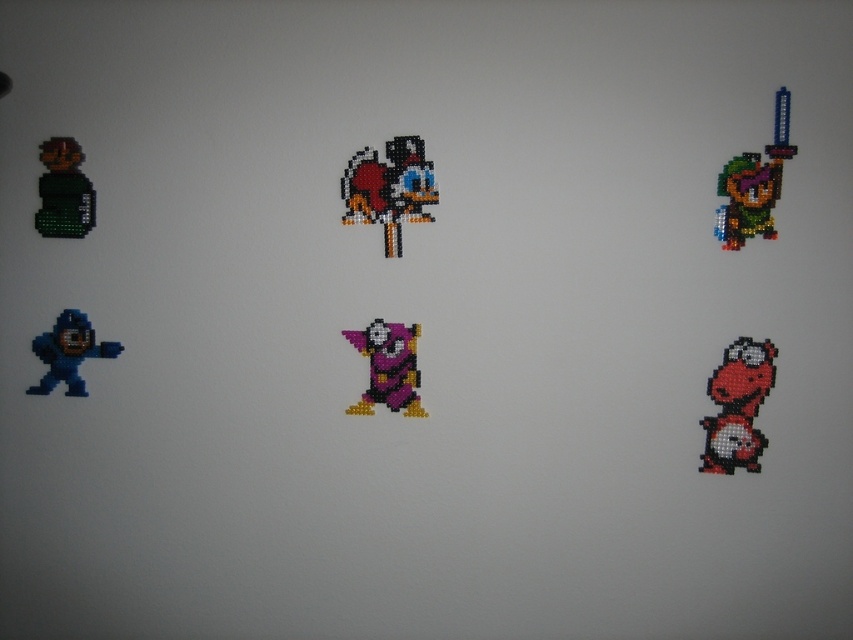
You are standing at the multicolored beaded figure at upper right and want to reach the closest object. Which object is it?

The closest object to the multicolored beaded figure at upper right is the green figure with a red helmet at top left, as they are 3.94 feet apart.

Consider the image. You are standing in front of the image and want to touch both the pixelated yellow duck at center and the blue matte astronaut at lower left. Which one can you reach first without moving your hand?

The pixelated yellow duck at center is in front of the blue matte astronaut at lower left, so you can reach the pixelated yellow duck at center first without moving your hand.

You are standing at the bottom left corner of the image. You need to walk to the point marked as point (x=77, y=214). However, there is an obstacle at point (x=732, y=179). Will you encounter the obstacle before reaching your destination?

Yes, you will encounter the obstacle at point (x=732, y=179) before reaching the destination at point (x=77, y=214) because the obstacle is closer to your starting position at the bottom left corner.